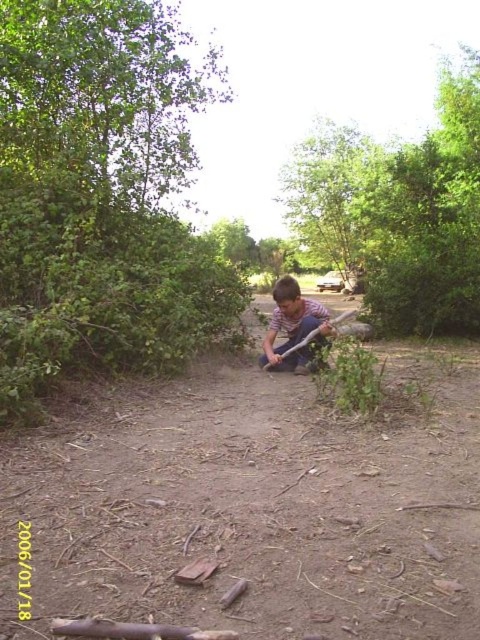
Is brown dirt path at center in front of striped shirt at center?

Yes.

What do you see at coordinates (256, 508) in the screenshot?
I see `brown dirt path at center` at bounding box center [256, 508].

Where is `brown dirt path at center`? This screenshot has height=640, width=480. brown dirt path at center is located at coordinates click(256, 508).

Which of these two, green leafy bush at upper left or green leafy tree at upper center, stands shorter?

Standing shorter between the two is green leafy tree at upper center.

Is point (56, 36) in front of point (333, 244)?

Yes.

Is point (35, 115) closer to viewer compared to point (357, 180)?

Yes, it is.

Find the location of a particular element. green leafy bush at upper left is located at coordinates (100, 195).

Between green leafy bush at upper left and striped shirt at center, which one is positioned lower?

striped shirt at center is below.

Can you confirm if green leafy bush at upper left is shorter than striped shirt at center?

In fact, green leafy bush at upper left may be taller than striped shirt at center.

Between point (54, 36) and point (316, 301), which one is positioned behind?

Point (316, 301)

This screenshot has width=480, height=640. What are the coordinates of `green leafy bush at upper left` in the screenshot? It's located at (100, 195).